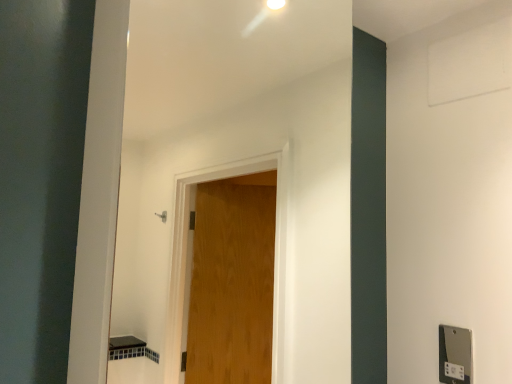
Describe the element at coordinates (455, 355) in the screenshot. I see `white plastic electric outlet at lower right` at that location.

Where is `white plastic electric outlet at lower right`? The width and height of the screenshot is (512, 384). white plastic electric outlet at lower right is located at coordinates (455, 355).

Find the location of a particular element. The height and width of the screenshot is (384, 512). white plastic electric outlet at lower right is located at coordinates (455, 355).